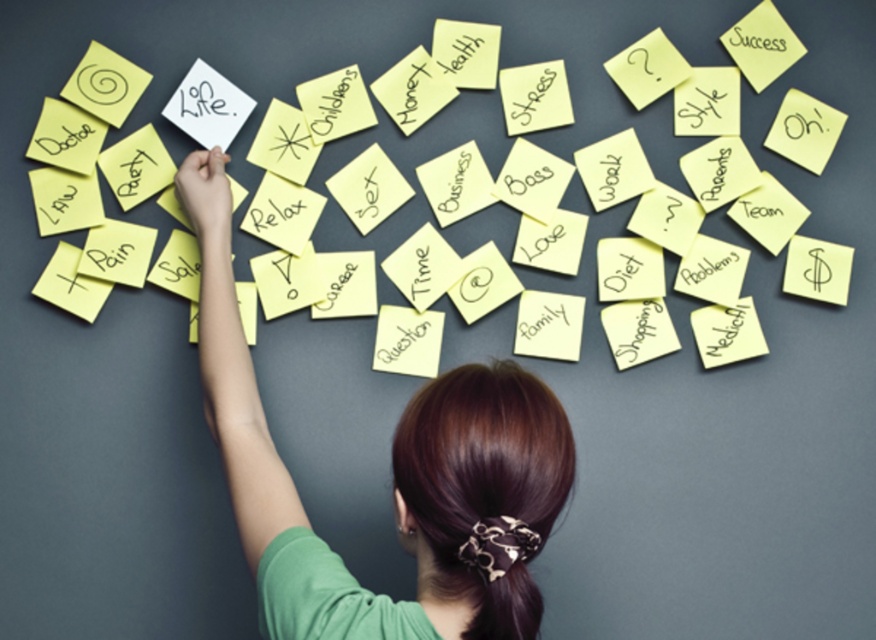
Question: Which of the following is the closest to the observer?

Choices:
 (A) green fabric shirt at center
 (B) matte yellow sticky note at upper right

Answer: (A)

Question: Is green fabric shirt at center bigger than matte yellow sticky note at upper right?

Choices:
 (A) yes
 (B) no

Answer: (A)

Question: Which point is closer to the camera?

Choices:
 (A) matte yellow sticky note at upper right
 (B) green fabric shirt at center

Answer: (B)

Question: Is green fabric shirt at center further to the viewer compared to matte yellow sticky note at upper right?

Choices:
 (A) yes
 (B) no

Answer: (B)

Question: Can you confirm if green fabric shirt at center is positioned to the left of matte yellow sticky note at upper right?

Choices:
 (A) yes
 (B) no

Answer: (A)